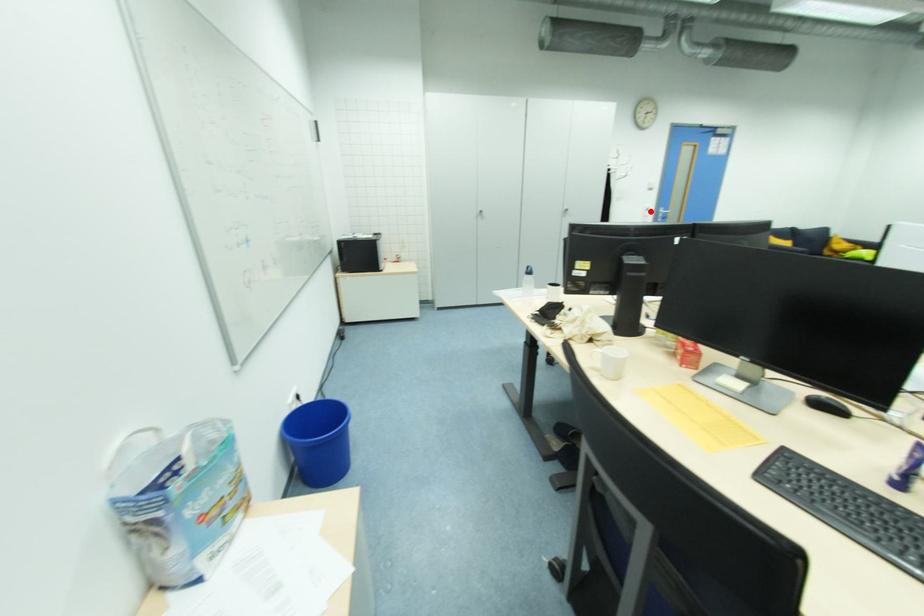
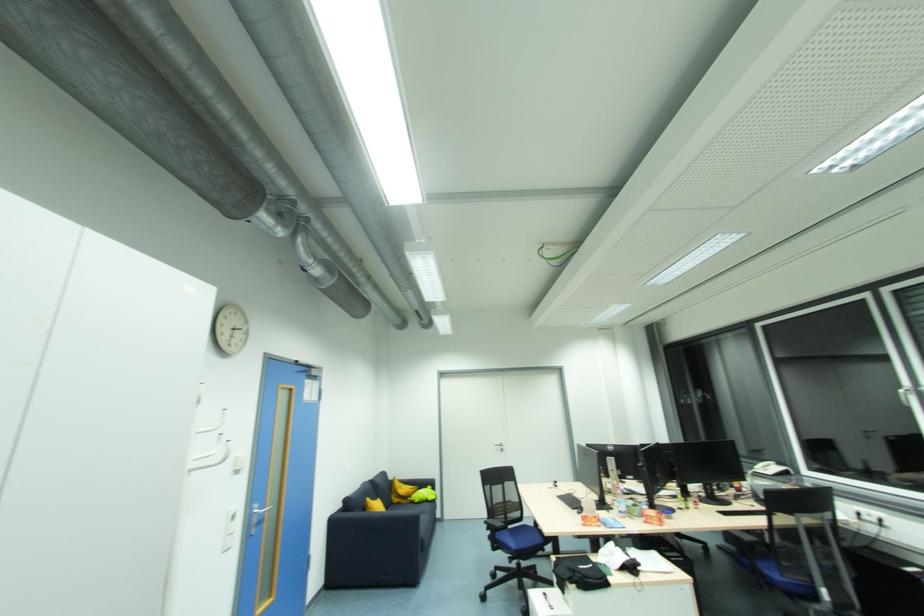
The point at the highlighted location is marked in the first image. Where is the corresponding point in the second image?

(236, 520)